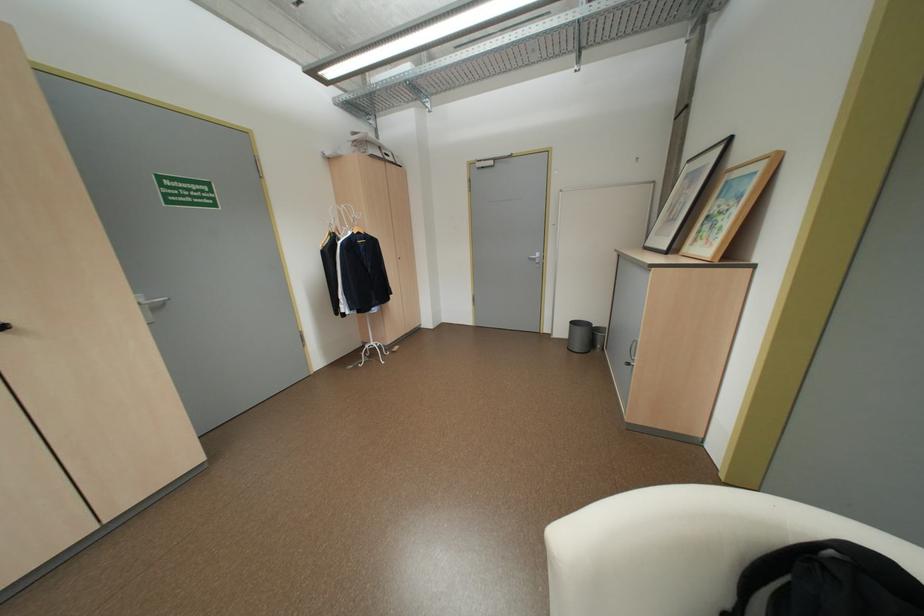
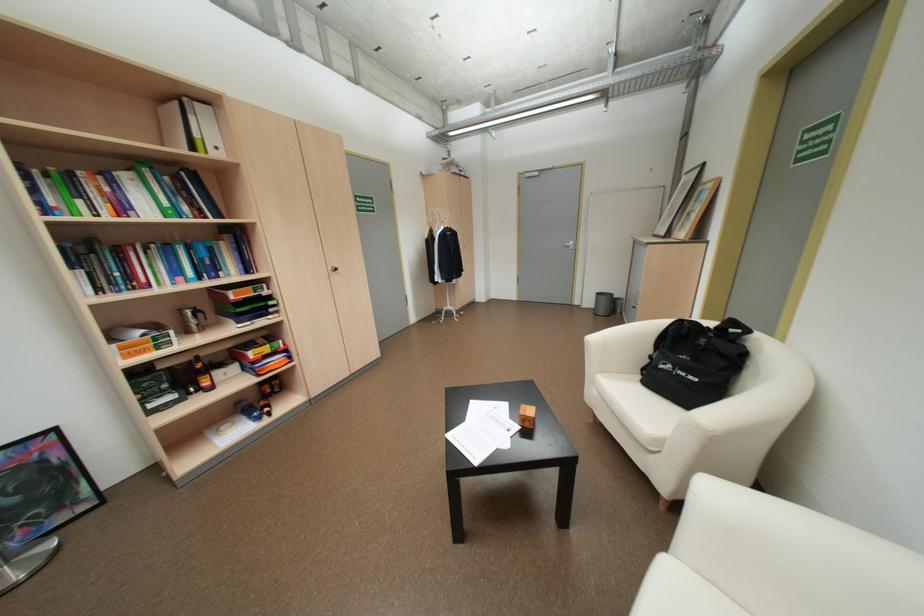
The images are taken continuously from a first-person perspective. In which direction are you moving?

The movement direction of the cameraman is left, backward.